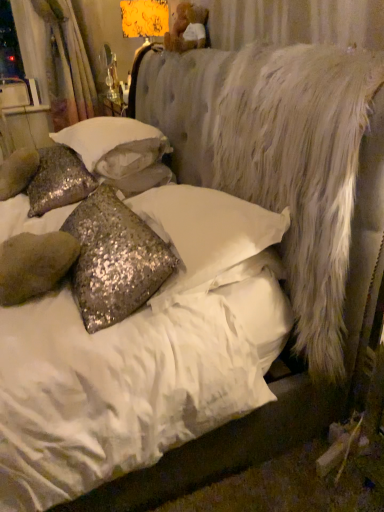
Question: Considering the relative positions of sparkly silver pillow at left, arranged as the third pillow when viewed from the front, and white textured curtain at upper left in the image provided, is sparkly silver pillow at left, arranged as the third pillow when viewed from the front, to the right of white textured curtain at upper left from the viewer's perspective?

Choices:
 (A) no
 (B) yes

Answer: (B)

Question: Would you say white textured curtain at upper left is part of sparkly silver pillow at left, arranged as the third pillow when viewed from the front,'s contents?

Choices:
 (A) no
 (B) yes

Answer: (A)

Question: Is sparkly silver pillow at left, arranged as the third pillow when viewed from the front, to the left of white textured curtain at upper left from the viewer's perspective?

Choices:
 (A) yes
 (B) no

Answer: (B)

Question: Is sparkly silver pillow at left, marked as the 1th pillow in a back-to-front arrangement, oriented towards white textured curtain at upper left?

Choices:
 (A) no
 (B) yes

Answer: (A)

Question: Is sparkly silver pillow at left, marked as the 1th pillow in a back-to-front arrangement, closer to the viewer compared to white textured curtain at upper left?

Choices:
 (A) no
 (B) yes

Answer: (B)

Question: Is point (339, 130) positioned closer to the camera than point (77, 52)?

Choices:
 (A) closer
 (B) farther

Answer: (A)

Question: Considering the positions of white fluffy mattress at right and white textured curtain at upper left in the image, is white fluffy mattress at right bigger or smaller than white textured curtain at upper left?

Choices:
 (A) big
 (B) small

Answer: (A)

Question: Considering their positions, is white fluffy mattress at right located in front of or behind white textured curtain at upper left?

Choices:
 (A) front
 (B) behind

Answer: (A)

Question: From the image's perspective, is white fluffy mattress at right positioned above or below white textured curtain at upper left?

Choices:
 (A) above
 (B) below

Answer: (B)

Question: From a real-world perspective, is white sequined pillow at center, which is the second pillow in back-to-front order, physically located above or below white textured curtain at upper left?

Choices:
 (A) above
 (B) below

Answer: (B)

Question: Do you think white sequined pillow at center, positioned as the 2th pillow in front-to-back order, is within white textured curtain at upper left, or outside of it?

Choices:
 (A) inside
 (B) outside

Answer: (B)

Question: Based on their sizes in the image, would you say white sequined pillow at center, positioned as the 2th pillow in front-to-back order, is bigger or smaller than white textured curtain at upper left?

Choices:
 (A) big
 (B) small

Answer: (B)

Question: Is white sequined pillow at center, positioned as the 2th pillow in front-to-back order, in front of or behind white textured curtain at upper left in the image?

Choices:
 (A) front
 (B) behind

Answer: (A)

Question: Is silver sequined pillow at center, arranged as the 3th pillow when viewed from the back, situated inside white sequined pillow at center, which is the second pillow in back-to-front order, or outside?

Choices:
 (A) outside
 (B) inside

Answer: (A)

Question: Would you say silver sequined pillow at center, arranged as the 3th pillow when viewed from the back, is to the left or to the right of white sequined pillow at center, which is the second pillow in back-to-front order, in the picture?

Choices:
 (A) right
 (B) left

Answer: (A)